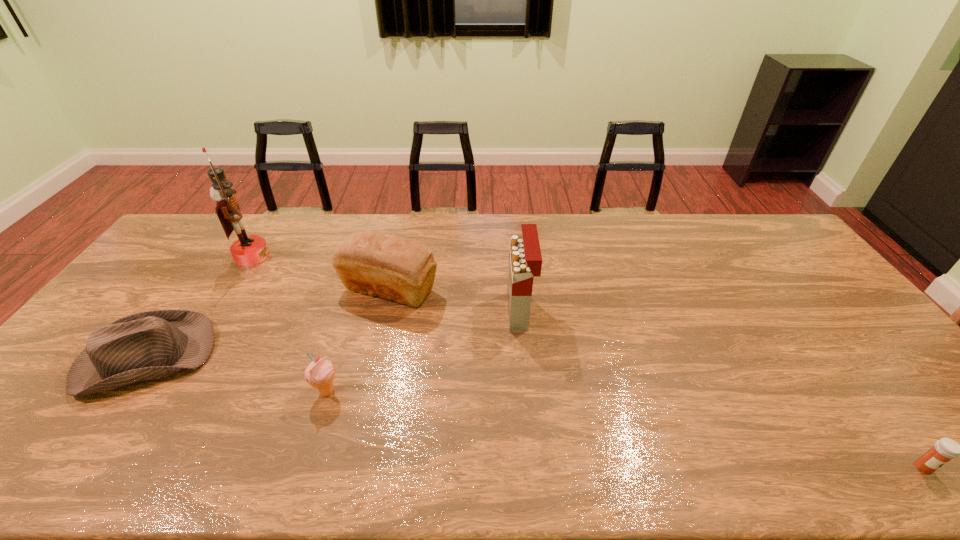
The height and width of the screenshot is (540, 960). In order to click on vacant region located 0.230m with the lid open on the cigarette case in this screenshot , I will do `click(431, 311)`.

You are a GUI agent. You are given a task and a screenshot of the screen. Output one action in this format:
    pyautogui.click(x=<x>, y=<y>)
    Task: Click on the vacant space located 0.070m with the lid open on the cigarette case
    The width and height of the screenshot is (960, 540).
    Given the screenshot: What is the action you would take?
    pyautogui.click(x=485, y=311)

Where is `free spot located 0.340m with the lid open on the cigarette case`? This screenshot has width=960, height=540. free spot located 0.340m with the lid open on the cigarette case is located at coordinates (395, 311).

Where is `vacant space located 0.290m on the back of the bread`? This screenshot has height=540, width=960. vacant space located 0.290m on the back of the bread is located at coordinates (405, 219).

Locate an element on the screen. Image resolution: width=960 pixels, height=540 pixels. vacant region located 0.080m on the left of the icecream is located at coordinates (281, 392).

At what (x,y) coordinates should I click in order to perform the action: click on free space located on the right of the fedora. Please return your answer as a coordinate pair (x, y). The width and height of the screenshot is (960, 540). Looking at the image, I should click on 337,359.

Find the location of a particular element. This screenshot has width=960, height=540. object situated at the far edge is located at coordinates 247,250.

Locate an element on the screen. This screenshot has height=540, width=960. object positioned at the near edge is located at coordinates [945, 449].

You are a GUI agent. You are given a task and a screenshot of the screen. Output one action in this format:
    pyautogui.click(x=<x>, y=<y>)
    Task: Click on the object that is at the left edge
    The image size is (960, 540).
    Given the screenshot: What is the action you would take?
    pyautogui.click(x=149, y=345)

Locate an element on the screen. This screenshot has width=960, height=540. object at the right edge is located at coordinates (945, 449).